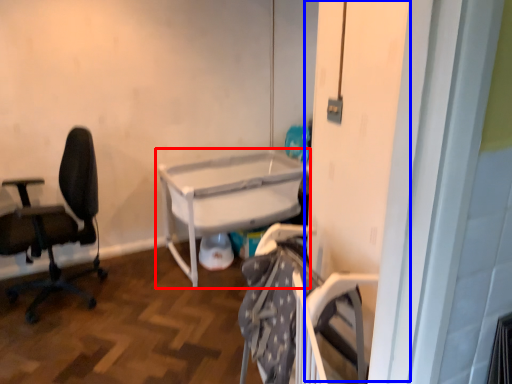
Question: Which point is further to the camera, table (highlighted by a red box) or screen door (highlighted by a blue box)?

Choices:
 (A) table
 (B) screen door

Answer: (A)